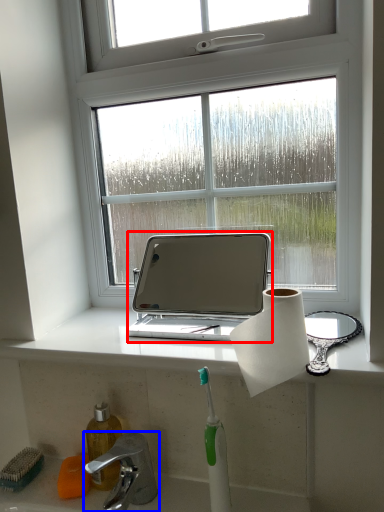
Question: Which of the following is the closest to the observer, laptop (highlighted by a red box) or tap (highlighted by a blue box)?

Choices:
 (A) laptop
 (B) tap

Answer: (B)